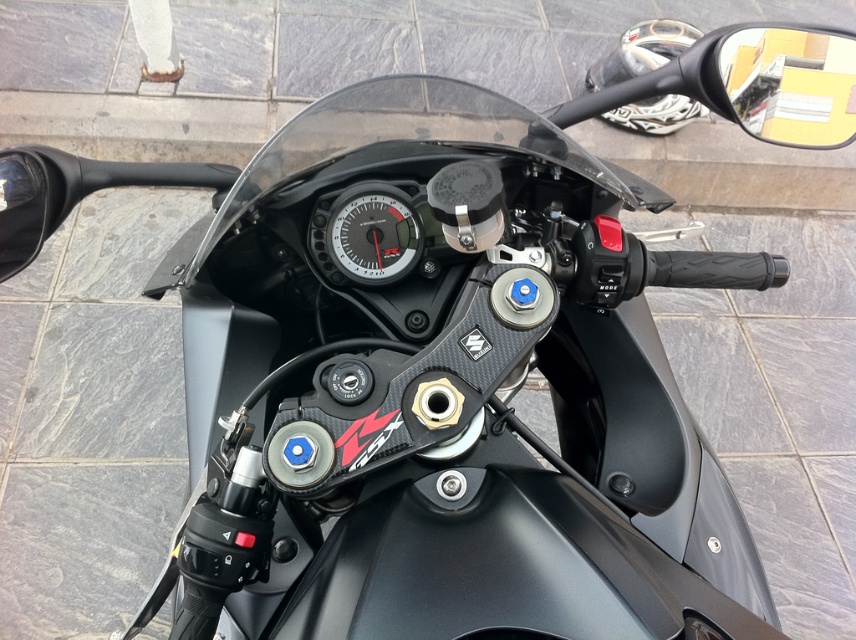
Is point (854, 80) in front of point (363, 259)?

That is False.

Describe the element at coordinates (777, 81) in the screenshot. Image resolution: width=856 pixels, height=640 pixels. I see `yellow matte side mirror at upper right` at that location.

At what (x,y) coordinates should I click in order to perform the action: click on yellow matte side mirror at upper right. Please return your answer as a coordinate pair (x, y). Looking at the image, I should click on (777, 81).